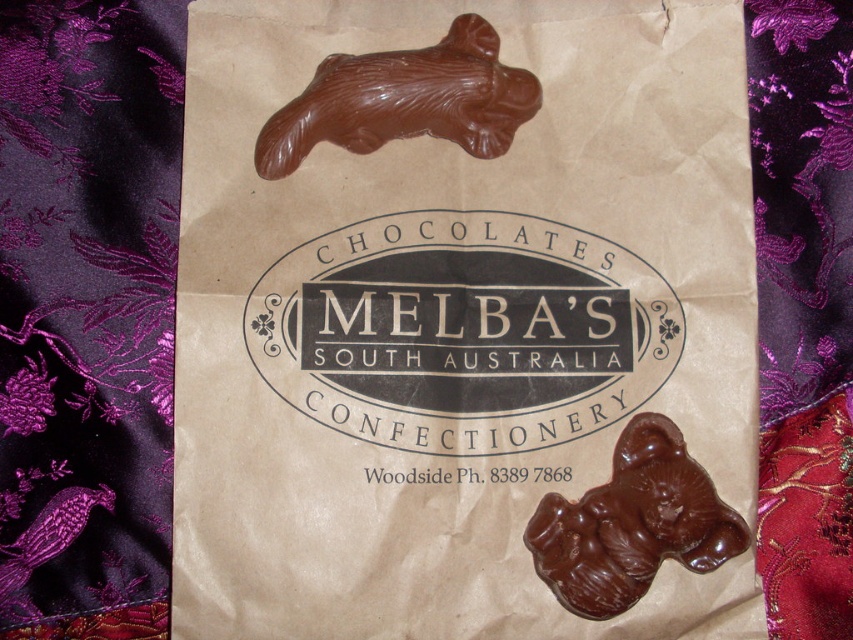
Question: Which is farther from the chocolatesmoothbear at upper center?

Choices:
 (A) shiny dark brown bear at bottom right
 (B) purple brocade quilt at left

Answer: (A)

Question: Can you confirm if purple brocade quilt at left is bigger than purple brocade quilt at lower right?

Choices:
 (A) no
 (B) yes

Answer: (B)

Question: Which of the following is the closest to the observer?

Choices:
 (A) purple brocade quilt at lower right
 (B) brown paper bag at center
 (C) purple brocade quilt at left

Answer: (C)

Question: Estimate the real-world distances between objects in this image. Which object is farther from the chocolatesmoothbear at upper center?

Choices:
 (A) purple brocade quilt at left
 (B) brown paper bag at center
 (C) purple brocade quilt at lower right
 (D) shiny dark brown bear at bottom right

Answer: (D)

Question: Can you confirm if purple brocade quilt at lower right is positioned below chocolatesmoothbear at upper center?

Choices:
 (A) yes
 (B) no

Answer: (A)

Question: Is purple brocade quilt at lower right to the right of shiny dark brown bear at bottom right from the viewer's perspective?

Choices:
 (A) no
 (B) yes

Answer: (B)